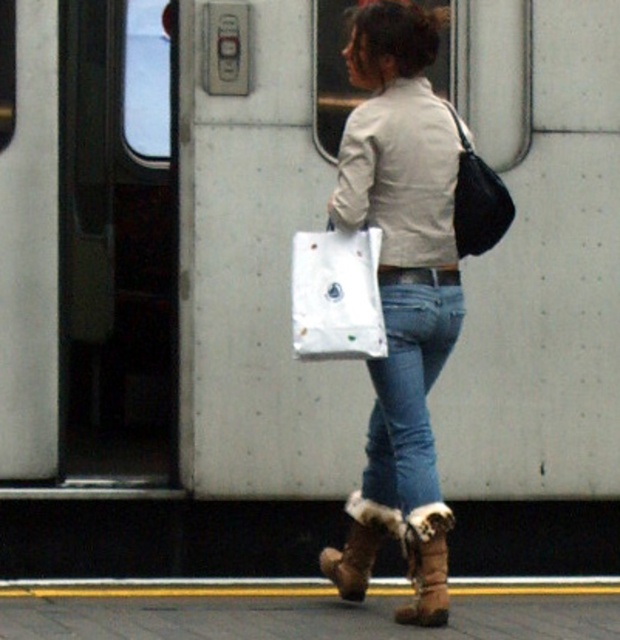
You are the person in the scene holding the white paper bag at center. You want to place it on the yellow tactile paving strip at the edge of the platform. Can you reach it without moving your feet?

The white paper bag at center is 16.64 feet away from you, so you cannot reach it without moving your feet since that distance is too far to reach while staying in place.

You are standing on a subway platform and want to board the train that is about to arrive. You are currently holding a white paper bag in your left hand and a black shoulder bag over your right shoulder. Your jeans at center are 5.16 meters away from the train entrance. Can you reach the train entrance without moving your feet?

The jeans at center are 5.16 meters away from the viewer, so the distance between you and the train entrance is too far to reach without moving your feet.

You are a delivery person who needs to place a package on the platform. The package is as tall as the white paper bag at center. Can it fit under the train, which has a clearance of 30 cm? The brown suede boot at lower center is 25 cm tall.

The white paper bag at center is taller than the brown suede boot at lower center, which is 25 cm tall. Since the package is as tall as the white paper bag at center, it exceeds the 30 cm clearance and cannot fit under the train.